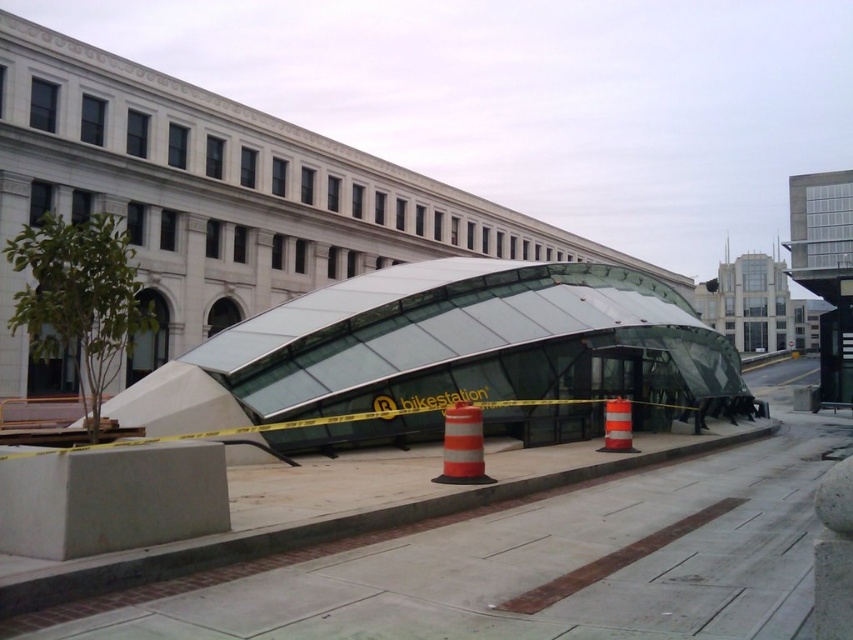
You are standing at the bike station entrance and want to walk towards the point marked as point (712, 564). Which direction should you go relative to point (605, 419)?

You should walk towards the point (712, 564), which is in front of point (605, 419), so move forward in the direction away from the bike station entrance.

You are standing at the entrance of the bike station and want to place a new traffic cone exactly 0.1 units to the right of the orange reflective cone at center. What are the coordinates of the new position?

The orange reflective cone at center is located at point (x=462, y=445). Adding 0.1 to the x coordinate gives 0.798, so the new position would be at coordinates (x=462, y=509).

You are a delivery person with a cart that is 5 meters wide. You need to move through the space between the orange reflective cone at center and the orange reflective traffic cone at center. Can your cart fit through the gap?

The distance between the orange reflective cone at center and orange reflective traffic cone at center is 4.83 meters. Since your cart is 5 meters wide, it is slightly wider than the available space. Therefore, your cart cannot fit through the gap.